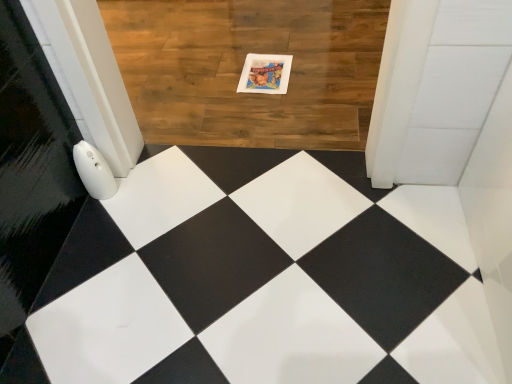
This screenshot has width=512, height=384. Identify the location of free space that is to the left of matte paper postcard at center. (212, 78).